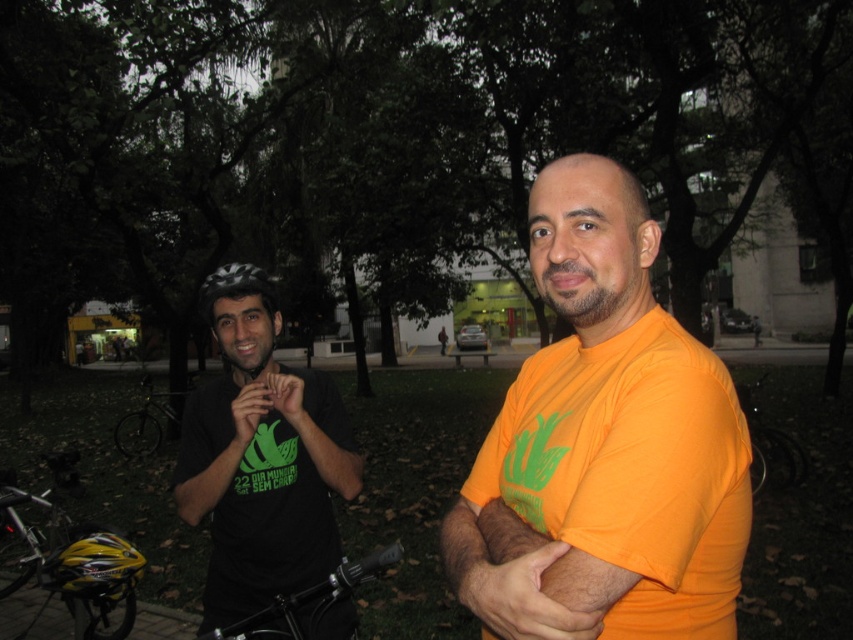
Is yellow matte helmet at lower left positioned in front of black matte bicycle at center?

Yes, yellow matte helmet at lower left is in front of black matte bicycle at center.

Is yellow matte helmet at lower left below black matte bicycle at center?

Yes.

Does point (57, 547) come behind point (758, 380)?

No, (57, 547) is closer to viewer.

Image resolution: width=853 pixels, height=640 pixels. Identify the location of yellow matte helmet at lower left. (68, 561).

Does yellow matte helmet at lower left have a greater width compared to orange matte shirt at center?

Indeed, yellow matte helmet at lower left has a greater width compared to orange matte shirt at center.

The height and width of the screenshot is (640, 853). Describe the element at coordinates (68, 561) in the screenshot. I see `yellow matte helmet at lower left` at that location.

Does point (103, 564) lie behind point (489, 616)?

Yes, it is.

Locate an element on the screen. This screenshot has height=640, width=853. yellow matte helmet at lower left is located at coordinates 68,561.

Does orange cotton shirt at center lie behind orange matte shirt at center?

No, orange cotton shirt at center is closer to the viewer.

Who is positioned more to the right, orange cotton shirt at center or orange matte shirt at center?

orange cotton shirt at center is more to the right.

Is point (587, 588) farther from camera compared to point (466, 577)?

No, it is not.

Where is `orange cotton shirt at center`? Image resolution: width=853 pixels, height=640 pixels. orange cotton shirt at center is located at coordinates (607, 444).